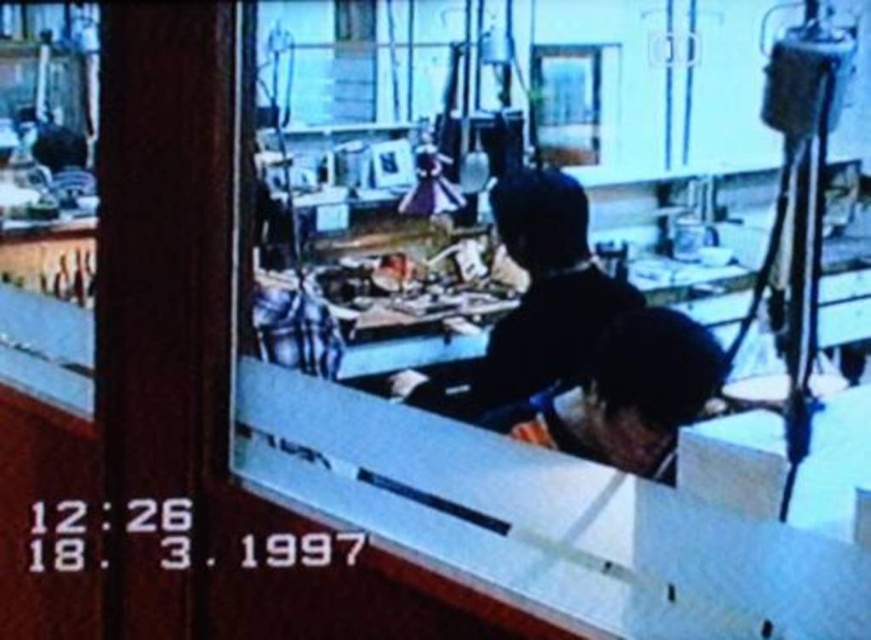
Question: Does black matte jacket at center come behind black matte helmet at center?

Choices:
 (A) yes
 (B) no

Answer: (A)

Question: Which of the following is the farthest from the observer?

Choices:
 (A) black matte helmet at center
 (B) black matte jacket at center

Answer: (B)

Question: Which point is farther to the camera?

Choices:
 (A) black matte helmet at center
 (B) black matte jacket at center

Answer: (B)

Question: Does black matte jacket at center have a larger size compared to black matte helmet at center?

Choices:
 (A) yes
 (B) no

Answer: (A)

Question: Does black matte jacket at center appear over black matte helmet at center?

Choices:
 (A) no
 (B) yes

Answer: (B)

Question: Which point is farther to the camera?

Choices:
 (A) black matte helmet at center
 (B) black matte jacket at center

Answer: (B)